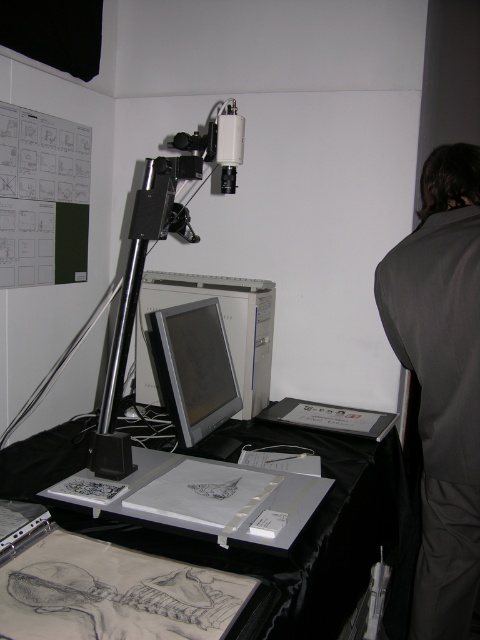
You are setting up for a presentation and need to place a 15 cm tall laptop on the metallic gray table at center or the matte silver monitor at center. Which object can accommodate the laptop without it touching the floor?

The metallic gray table at center is taller than the matte silver monitor at center, so placing the 15 cm tall laptop on the metallic gray table at center would ensure it doesn

You are setting up for a presentation and need to place a laptop between the metallic gray table at center and the matte silver monitor at center. Considering their sizes, will the space between them be sufficient for the laptop?

The metallic gray table at center is wider than the matte silver monitor at center, so placing a laptop between them should be possible as there will be enough space.

You are setting up for a presentation and need to adjust the position of the dark gray fabric at right and the matte silver monitor at center. According to the scene description, which object is positioned to the right of the other?

The dark gray fabric at right is to the right of the matte silver monitor at center.